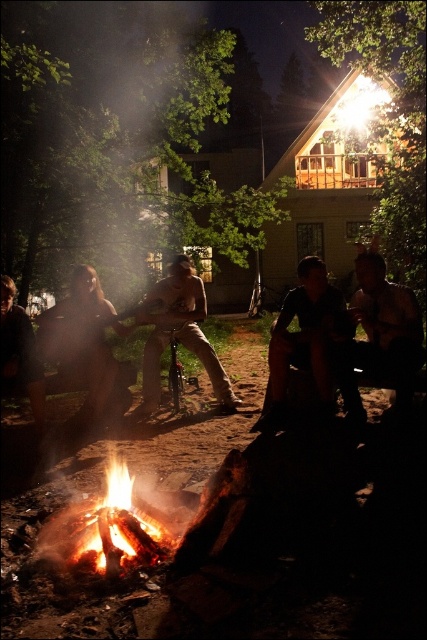
Can you confirm if dark fabric pants at lower right is bigger than dark brown leather jacket at lower left?

Yes.

Is the position of dark fabric pants at lower right less distant than that of dark brown leather jacket at lower left?

Yes, it is in front of dark brown leather jacket at lower left.

This screenshot has height=640, width=427. What are the coordinates of `dark fabric pants at lower right` in the screenshot? It's located at (306, 339).

At what (x,y) coordinates should I click in order to perform the action: click on tan leather pants at center. Please return your answer as a coordinate pair (x, y). Looking at the image, I should click on 178,332.

Between tan leather pants at center and dark brown leather jacket at lower left, which one appears on the right side from the viewer's perspective?

tan leather pants at center is more to the right.

Is point (236, 406) positioned before point (20, 333)?

No, it is behind (20, 333).

The image size is (427, 640). In order to click on tan leather pants at center in this screenshot , I will do `click(178, 332)`.

Who is positioned more to the left, brown leather jacket at center or blonde hair at center?

blonde hair at center is more to the left.

Consider the image. Is brown leather jacket at center to the left of blonde hair at center from the viewer's perspective?

No, brown leather jacket at center is not to the left of blonde hair at center.

Who is more forward, (406,324) or (96,312)?

Point (406,324)

The width and height of the screenshot is (427, 640). Find the location of `brown leather jacket at center`. brown leather jacket at center is located at coordinates (380, 336).